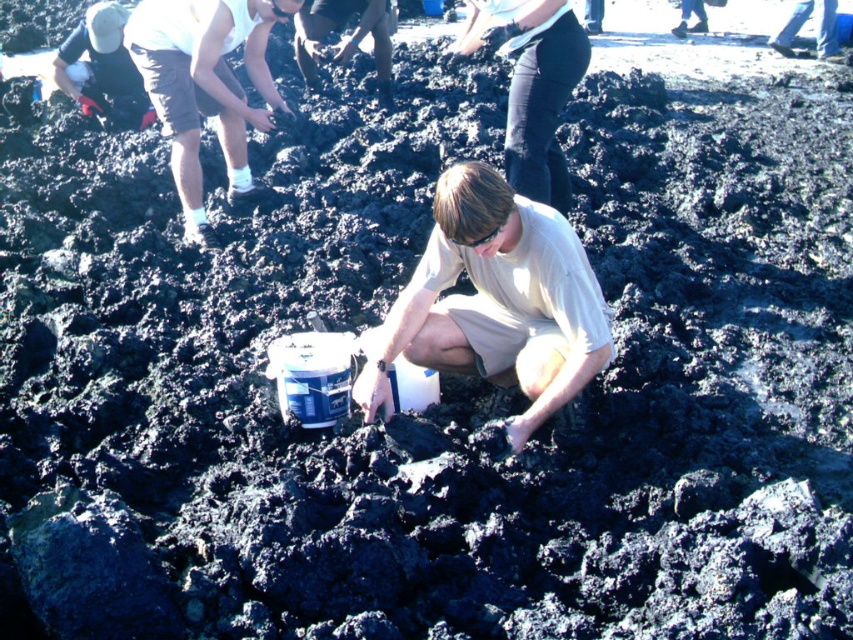
Question: Which of the following is the closest to the observer?

Choices:
 (A) (134, 96)
 (B) (318, 29)
 (C) (554, 29)

Answer: (C)

Question: Which object is the closest to the light beige cotton shirt at center?

Choices:
 (A) dark blue jeans at center
 (B) matte black shirt at upper left
 (C) matte black shirt at center
 (D) light brown shorts at upper left

Answer: (A)

Question: Does light beige cotton shirt at center have a greater width compared to matte black shirt at center?

Choices:
 (A) no
 (B) yes

Answer: (A)

Question: Is light brown shorts at upper left positioned in front of matte black shirt at center?

Choices:
 (A) yes
 (B) no

Answer: (A)

Question: Can you confirm if light beige cotton shirt at center is thinner than matte black shirt at upper left?

Choices:
 (A) yes
 (B) no

Answer: (A)

Question: Which of the following is the farthest from the observer?

Choices:
 (A) dark blue jeans at center
 (B) light brown shorts at upper left
 (C) light beige cotton shirt at center
 (D) matte black shirt at upper left

Answer: (D)